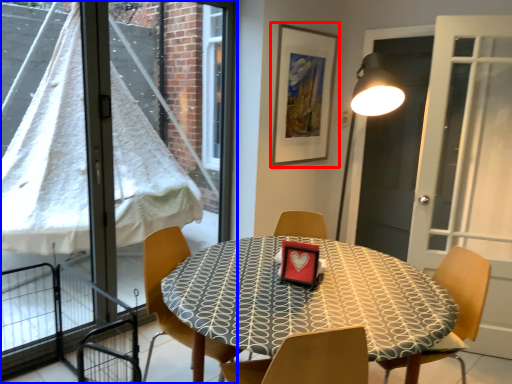
Question: Which point is further to the camera, picture frame (highlighted by a red box) or window (highlighted by a blue box)?

Choices:
 (A) picture frame
 (B) window

Answer: (A)